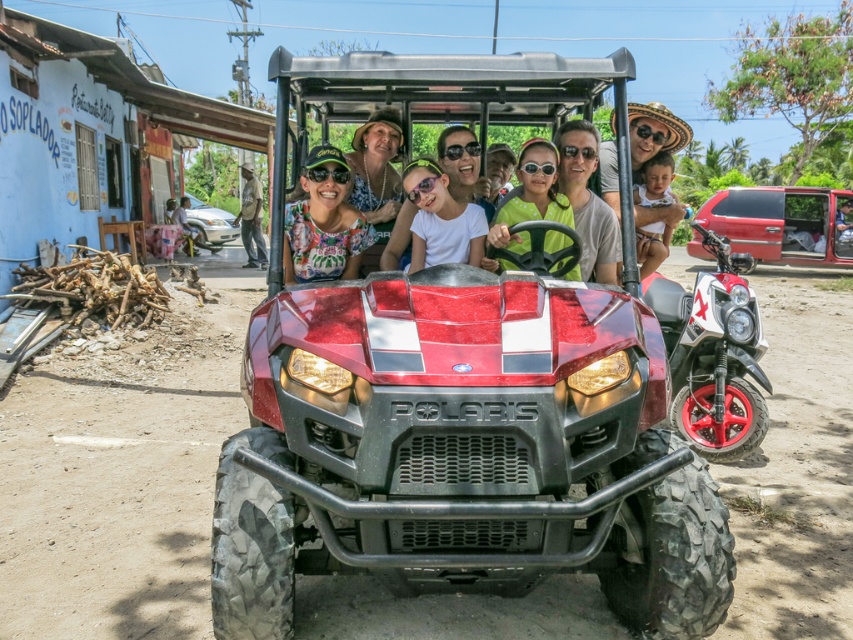
Is the position of white cloth baby at center more distant than that of metallic silver car at left?

No, it is not.

Is white cloth baby at center smaller than metallic silver car at left?

Indeed, white cloth baby at center has a smaller size compared to metallic silver car at left.

Is point (640, 228) in front of point (193, 209)?

Yes, it is.

Find the location of a particular element. The height and width of the screenshot is (640, 853). white cloth baby at center is located at coordinates (656, 180).

Who is higher up, metallic red jeep at right or black plastic goggles at center?

Positioned higher is metallic red jeep at right.

How distant is metallic red jeep at right from black plastic goggles at center?

14.21 meters

This screenshot has width=853, height=640. What do you see at coordinates (780, 225) in the screenshot? I see `metallic red jeep at right` at bounding box center [780, 225].

At what (x,y) coordinates should I click in order to perform the action: click on metallic red jeep at right. Please return your answer as a coordinate pair (x, y). The width and height of the screenshot is (853, 640). Looking at the image, I should click on pos(780,225).

Can you confirm if metallic silver car at left is positioned to the right of matte black goggles at center?

Incorrect, metallic silver car at left is not on the right side of matte black goggles at center.

Is metallic silver car at left smaller than matte black goggles at center?

Actually, metallic silver car at left might be larger than matte black goggles at center.

What do you see at coordinates (207, 224) in the screenshot? I see `metallic silver car at left` at bounding box center [207, 224].

You are a GUI agent. You are given a task and a screenshot of the screen. Output one action in this format:
    pyautogui.click(x=<x>, y=<y>)
    Task: Click on the metallic silver car at left
    This screenshot has height=640, width=853.
    Given the screenshot: What is the action you would take?
    pyautogui.click(x=207, y=224)